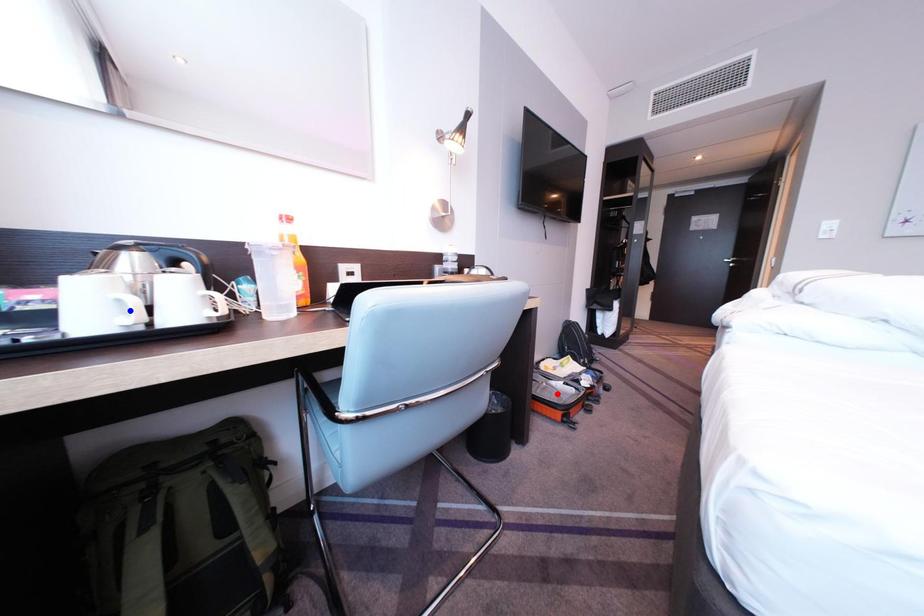
Question: In the image, two points are highlighted. Which point is nearer to the camera? Reply with the corresponding letter.

Choices:
 (A) blue point
 (B) red point

Answer: (A)